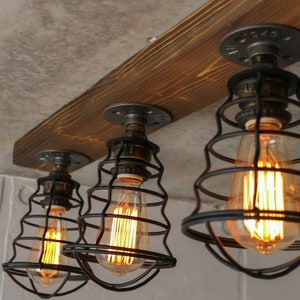
The width and height of the screenshot is (300, 300). Find the location of `fixtures`. fixtures is located at coordinates (54, 243), (119, 223), (250, 174), (195, 71).